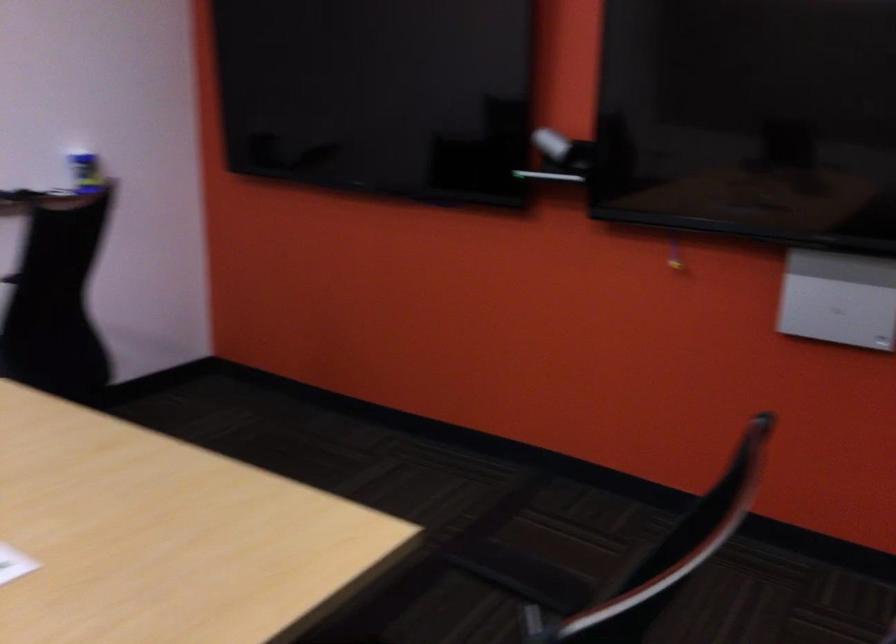
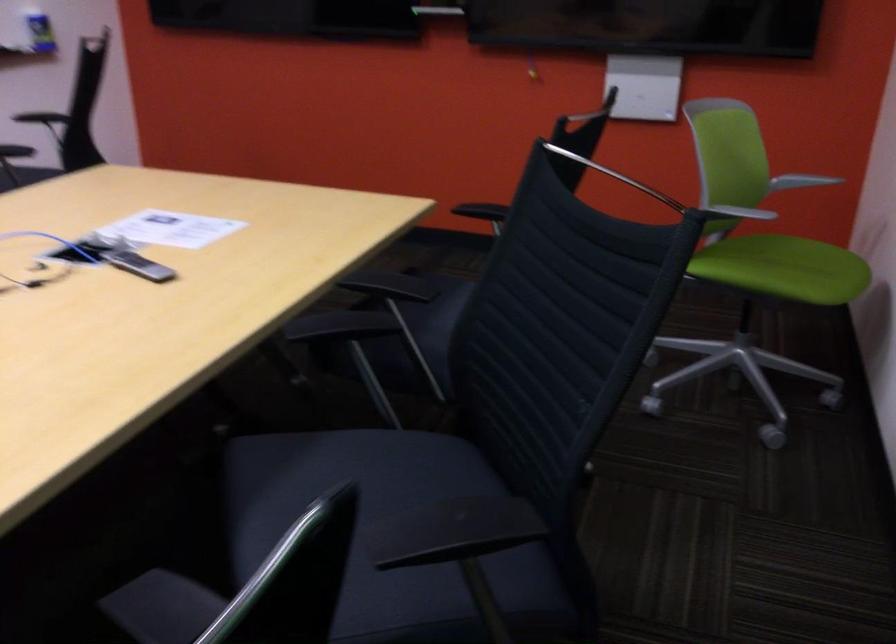
What movement of the cameraman would produce the second image?

The cameraman moved toward left, backward.